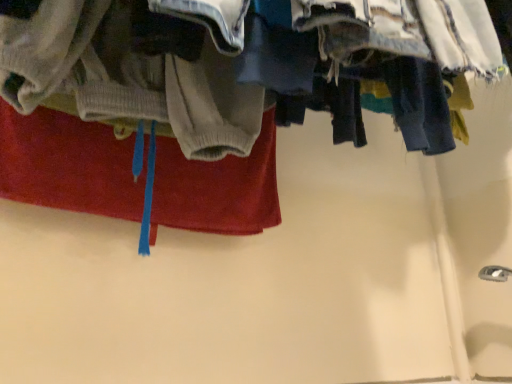
What is the approximate width of red cotton towel at upper left?

It is 2.63 inches.

What do you see at coordinates (68, 164) in the screenshot? The height and width of the screenshot is (384, 512). I see `red cotton towel at upper left` at bounding box center [68, 164].

Find the location of a particular element. This screenshot has width=512, height=384. red cotton towel at upper left is located at coordinates (x=68, y=164).

What do you see at coordinates (248, 61) in the screenshot? The height and width of the screenshot is (384, 512). I see `denim fabric pants at upper right` at bounding box center [248, 61].

Where is `denim fabric pants at upper right`? This screenshot has height=384, width=512. denim fabric pants at upper right is located at coordinates (248, 61).

Measure the distance between point (274, 53) and camera.

The distance of point (274, 53) from camera is 23.98 inches.

Where is `red cotton towel at upper left`? This screenshot has width=512, height=384. red cotton towel at upper left is located at coordinates (68, 164).

Based on their positions, is denim fabric pants at upper right located to the left or right of red cotton towel at upper left?

Based on their positions, denim fabric pants at upper right is located to the right of red cotton towel at upper left.

In the scene shown: Which object is further away from the camera taking this photo, denim fabric pants at upper right or red cotton towel at upper left?

red cotton towel at upper left is more distant.

Is point (262, 77) positioned behind point (193, 208)?

No, it is not.

From the image's perspective, which is above, denim fabric pants at upper right or red cotton towel at upper left?

denim fabric pants at upper right, from the image's perspective.

From a real-world perspective, is denim fabric pants at upper right located higher than red cotton towel at upper left?

Indeed, from a real-world perspective, denim fabric pants at upper right stands above red cotton towel at upper left.

Considering the sizes of objects denim fabric pants at upper right and red cotton towel at upper left in the image provided, who is wider, denim fabric pants at upper right or red cotton towel at upper left?

denim fabric pants at upper right.

Considering the sizes of objects denim fabric pants at upper right and red cotton towel at upper left in the image provided, who is taller, denim fabric pants at upper right or red cotton towel at upper left?

denim fabric pants at upper right.

Can you confirm if denim fabric pants at upper right is bigger than red cotton towel at upper left?

Yes.

Is denim fabric pants at upper right situated inside red cotton towel at upper left or outside?

The correct answer is: outside.

Is denim fabric pants at upper right not near red cotton towel at upper left?

No, denim fabric pants at upper right is not far from red cotton towel at upper left.

Is denim fabric pants at upper right facing away from red cotton towel at upper left?

Yes, denim fabric pants at upper right's orientation is away from red cotton towel at upper left.

How many degrees apart are the facing directions of denim fabric pants at upper right and red cotton towel at upper left?

The angular difference between denim fabric pants at upper right and red cotton towel at upper left is 0.000964 degrees.

How far apart are denim fabric pants at upper right and red cotton towel at upper left?

denim fabric pants at upper right is 8.39 inches away from red cotton towel at upper left.

Identify the location of closet above the red cotton towel at upper left (from a real-world perspective). The height and width of the screenshot is (384, 512). (248, 61).

Does red cotton towel at upper left appear on the right side of denim fabric pants at upper right?

No, red cotton towel at upper left is not to the right of denim fabric pants at upper right.

Which object is closer to the camera taking this photo, red cotton towel at upper left or denim fabric pants at upper right?

denim fabric pants at upper right is closer to the camera.

Does point (176, 146) come farther from viewer compared to point (106, 94)?

Yes, point (176, 146) is farther from viewer.

From the image's perspective, who appears lower, red cotton towel at upper left or denim fabric pants at upper right?

red cotton towel at upper left appears lower in the image.

From a real-world perspective, relative to denim fabric pants at upper right, is red cotton towel at upper left vertically above or below?

In terms of real-world spatial position, red cotton towel at upper left is below denim fabric pants at upper right.

Considering the relative sizes of red cotton towel at upper left and denim fabric pants at upper right in the image provided, is red cotton towel at upper left thinner than denim fabric pants at upper right?

Yes, red cotton towel at upper left is thinner than denim fabric pants at upper right.

Does red cotton towel at upper left have a greater height compared to denim fabric pants at upper right?

No, red cotton towel at upper left is not taller than denim fabric pants at upper right.

Who is smaller, red cotton towel at upper left or denim fabric pants at upper right?

red cotton towel at upper left.

Is red cotton towel at upper left located outside denim fabric pants at upper right?

Absolutely, red cotton towel at upper left is external to denim fabric pants at upper right.

Is red cotton towel at upper left placed right next to denim fabric pants at upper right?

No.

Is red cotton towel at upper left facing towards denim fabric pants at upper right?

Yes.

The image size is (512, 384). I want to click on towel that is on the left side of denim fabric pants at upper right, so click(68, 164).

You are a GUI agent. You are given a task and a screenshot of the screen. Output one action in this format:
    pyautogui.click(x=<x>, y=<y>)
    Task: Click on the closet above the red cotton towel at upper left (from a real-world perspective)
    This screenshot has height=384, width=512.
    Given the screenshot: What is the action you would take?
    pyautogui.click(x=248, y=61)

Locate an element on the screen. This screenshot has width=512, height=384. closet above the red cotton towel at upper left (from the image's perspective) is located at coordinates (248, 61).